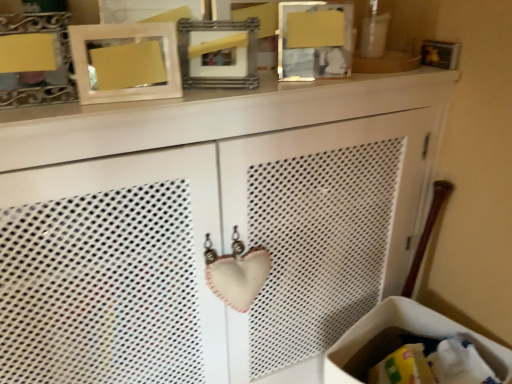
Question: Is matte white picture frame at upper center, the second picture frame positioned from the left, inside or outside of matte silver picture frame at upper left, the first picture frame from the left?

Choices:
 (A) outside
 (B) inside

Answer: (A)

Question: From their relative heights in the image, would you say matte white picture frame at upper center, the second picture frame positioned from the left, is taller or shorter than matte silver picture frame at upper left, acting as the 4th picture frame starting from the right?

Choices:
 (A) tall
 (B) short

Answer: (A)

Question: Considering the real-world distances, which object is farthest from the matte silver picture frame at upper left, acting as the 4th picture frame starting from the right?

Choices:
 (A) matte white picture frame at upper center, marked as the 3th picture frame in a right-to-left arrangement
 (B) wooden picture frame at upper center, which is the fourth picture frame from left to right
 (C) metallic silver picture frame at upper center, placed as the third picture frame when sorted from left to right
 (D) white fabric laundry basket at lower right

Answer: (D)

Question: Estimate the real-world distances between objects in this image. Which object is farther from the white fabric laundry basket at lower right?

Choices:
 (A) metallic silver picture frame at upper center, placed as the third picture frame when sorted from left to right
 (B) matte silver picture frame at upper left, acting as the 4th picture frame starting from the right
 (C) wooden picture frame at upper center, which is the fourth picture frame from left to right
 (D) matte white picture frame at upper center, marked as the 3th picture frame in a right-to-left arrangement

Answer: (B)